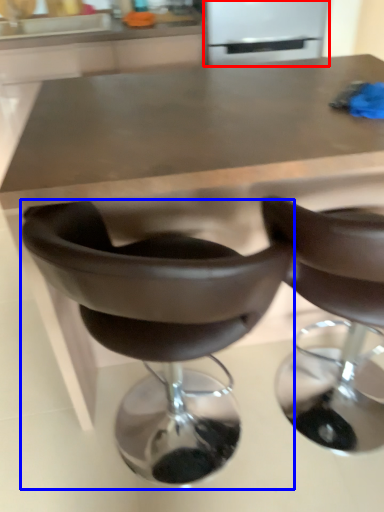
Question: Which object appears farthest to the camera in this image, appliance (highlighted by a red box) or chair (highlighted by a blue box)?

Choices:
 (A) appliance
 (B) chair

Answer: (A)